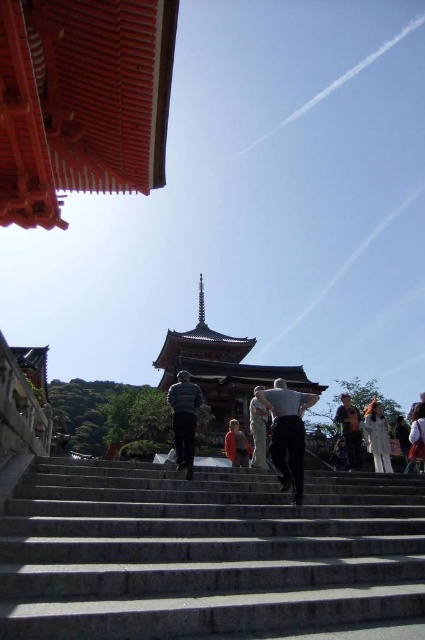
Question: Which object is the farthest from the light beige fabric jacket at center?

Choices:
 (A) white cotton dress at center
 (B) orange cotton shirt at center

Answer: (B)

Question: Among these points, which one is nearest to the camera?

Choices:
 (A) (362, 424)
 (B) (404, 435)
 (C) (413, 436)
 (D) (285, 481)

Answer: (D)

Question: Can you confirm if white cotton dress at lower right is wider than white cotton shirt at right?

Choices:
 (A) yes
 (B) no

Answer: (B)

Question: Can you confirm if light beige fabric jacket at center is positioned above light beige pants at center?

Choices:
 (A) yes
 (B) no

Answer: (A)

Question: Which of the following is the closest to the observer?

Choices:
 (A) light beige fabric jacket at center
 (B) white cotton dress at lower right

Answer: (A)

Question: Is orange cotton shirt at center further to camera compared to white cotton dress at lower right?

Choices:
 (A) yes
 (B) no

Answer: (A)